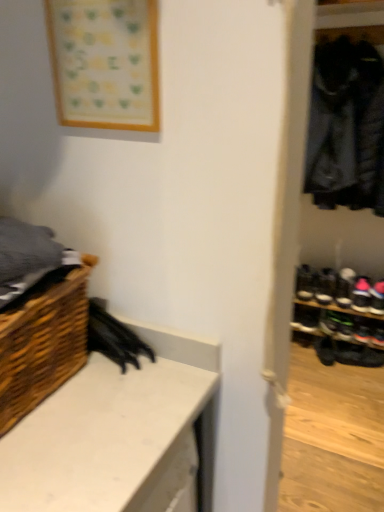
Question: Does black suede shoe at lower right, the first footwear viewed from the top, have a larger size compared to black leather shoe at right, the second footwear ordered from the bottom?

Choices:
 (A) no
 (B) yes

Answer: (A)

Question: From the image's perspective, is black suede shoe at lower right, the first footwear viewed from the top, over black leather shoe at right, which is the 3th footwear from top to bottom?

Choices:
 (A) yes
 (B) no

Answer: (A)

Question: From the image's perspective, is black suede shoe at lower right, acting as the fourth footwear starting from the bottom, beneath black leather shoe at right, the second footwear ordered from the bottom?

Choices:
 (A) yes
 (B) no

Answer: (B)

Question: Does black suede shoe at lower right, acting as the fourth footwear starting from the bottom, have a smaller size compared to black leather shoe at right, which is the 3th footwear from top to bottom?

Choices:
 (A) yes
 (B) no

Answer: (A)

Question: Are black suede shoe at lower right, the first footwear viewed from the top, and black leather shoe at right, the second footwear ordered from the bottom, beside each other?

Choices:
 (A) yes
 (B) no

Answer: (B)

Question: Is black suede shoe at lower right, the first footwear viewed from the top, positioned in front of black leather shoe at right, the second footwear ordered from the bottom?

Choices:
 (A) no
 (B) yes

Answer: (A)

Question: From the image's perspective, is black suede shoe at right, which appears as the 3th footwear when ordered from the bottom, over wooden frame at upper left?

Choices:
 (A) yes
 (B) no

Answer: (B)

Question: From a real-world perspective, is black suede shoe at right, positioned as the second footwear in top-to-bottom order, over wooden frame at upper left?

Choices:
 (A) yes
 (B) no

Answer: (B)

Question: From the image's perspective, does black suede shoe at right, which appears as the 3th footwear when ordered from the bottom, appear lower than wooden frame at upper left?

Choices:
 (A) yes
 (B) no

Answer: (A)

Question: Is black suede shoe at right, positioned as the second footwear in top-to-bottom order, far from wooden frame at upper left?

Choices:
 (A) yes
 (B) no

Answer: (A)

Question: Is wooden frame at upper left at the back of black suede shoe at right, positioned as the second footwear in top-to-bottom order?

Choices:
 (A) no
 (B) yes

Answer: (A)

Question: Is black suede shoe at right, positioned as the second footwear in top-to-bottom order, positioned behind wooden frame at upper left?

Choices:
 (A) no
 (B) yes

Answer: (B)

Question: Is black leather shoe at right, the second footwear ordered from the bottom, further to camera compared to black leather shoe at lower right, which appears as the first footwear when ordered from the bottom?

Choices:
 (A) yes
 (B) no

Answer: (B)